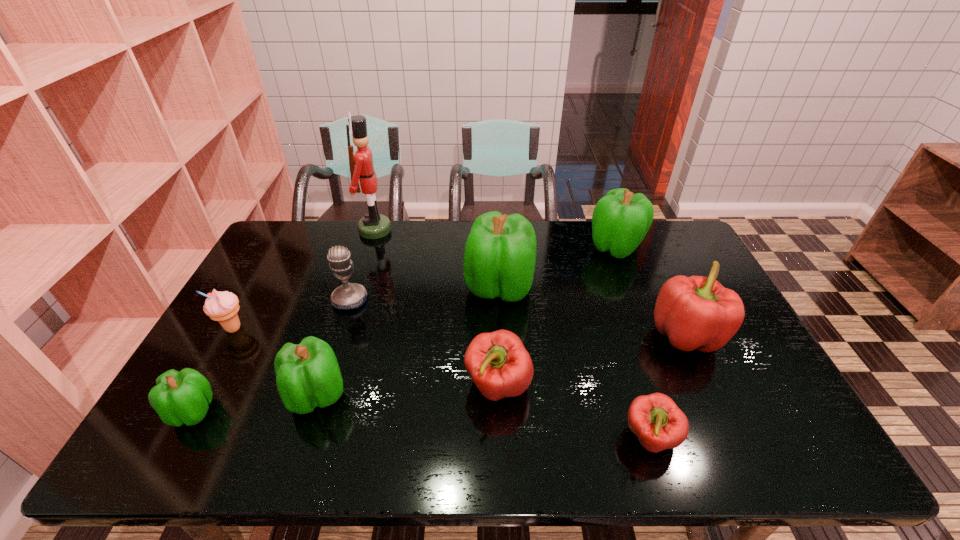
You are a GUI agent. You are given a task and a screenshot of the screen. Output one action in this format:
    pyautogui.click(x=<x>, y=<y>)
    Task: Click on the bell pepper that is the sixth closest one to the leftmost green bell pepper
    
    Given the screenshot: What is the action you would take?
    pyautogui.click(x=621, y=219)

Locate an element on the screen. bell pepper object that ranks as the fourth closest to the rightmost green bell pepper is located at coordinates (655, 419).

The width and height of the screenshot is (960, 540). In order to click on green bell pepper identified as the second closest to the biggest green bell pepper in this screenshot , I will do point(307,375).

Select which green bell pepper is the second closest to the smallest green bell pepper. Please provide its 2D coordinates. Your answer should be formatted as a tuple, i.e. [(x, y)], where the tuple contains the x and y coordinates of a point satisfying the conditions above.

[(500, 253)]

Identify which pink bell pepper is the closest to the tallest object. Please provide its 2D coordinates. Your answer should be formatted as a tuple, i.e. [(x, y)], where the tuple contains the x and y coordinates of a point satisfying the conditions above.

[(498, 363)]

Locate which pink bell pepper ranks in proximity to the icecream. Please provide its 2D coordinates. Your answer should be formatted as a tuple, i.e. [(x, y)], where the tuple contains the x and y coordinates of a point satisfying the conditions above.

[(498, 363)]

Where is `vacant space that satisfies the following two spatial constraints: 1. on the front side of the farthest bell pepper; 2. on the right side of the biggest pink bell pepper`? vacant space that satisfies the following two spatial constraints: 1. on the front side of the farthest bell pepper; 2. on the right side of the biggest pink bell pepper is located at coordinates (649, 335).

Find the location of `free space that satisfies the following two spatial constraints: 1. on the back side of the farthest green bell pepper; 2. on the left side of the biggest green bell pepper`. free space that satisfies the following two spatial constraints: 1. on the back side of the farthest green bell pepper; 2. on the left side of the biggest green bell pepper is located at coordinates (497, 247).

Identify the location of vacant region that satisfies the following two spatial constraints: 1. on the front-facing side of the second biggest pink bell pepper; 2. on the left side of the microphone. This screenshot has height=540, width=960. (323, 386).

At what (x,y) coordinates should I click in order to perform the action: click on free spot that satisfies the following two spatial constraints: 1. on the front-facing side of the tallest object; 2. on the front-facing side of the microphone. Please return your answer as a coordinate pair (x, y). Looking at the image, I should click on (353, 300).